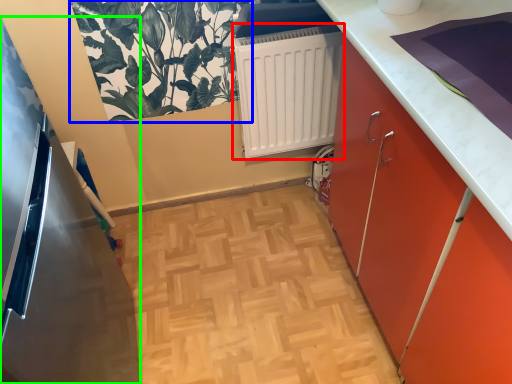
Question: Based on their relative distances, which object is farther from radiator (highlighted by a red box)? Choose from plant (highlighted by a blue box) and appliance (highlighted by a green box).

Choices:
 (A) plant
 (B) appliance

Answer: (B)